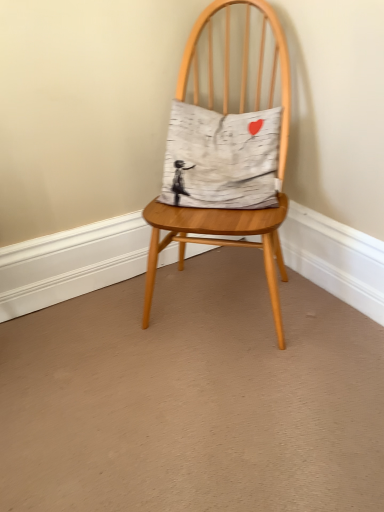
Question: Do you think wooden chair at center is within white cotton pillow at center, or outside of it?

Choices:
 (A) inside
 (B) outside

Answer: (B)

Question: Is wooden chair at center in front of or behind white cotton pillow at center in the image?

Choices:
 (A) behind
 (B) front

Answer: (B)

Question: Considering the positions of wooden chair at center and white cotton pillow at center in the image, is wooden chair at center bigger or smaller than white cotton pillow at center?

Choices:
 (A) small
 (B) big

Answer: (B)

Question: Considering their positions, is white cotton pillow at center located in front of or behind wooden chair at center?

Choices:
 (A) behind
 (B) front

Answer: (A)

Question: Would you say white cotton pillow at center is to the left or to the right of wooden chair at center in the picture?

Choices:
 (A) right
 (B) left

Answer: (B)

Question: From the image's perspective, relative to wooden chair at center, is white cotton pillow at center above or below?

Choices:
 (A) above
 (B) below

Answer: (A)

Question: Is white cotton pillow at center spatially inside wooden chair at center, or outside of it?

Choices:
 (A) outside
 (B) inside

Answer: (B)